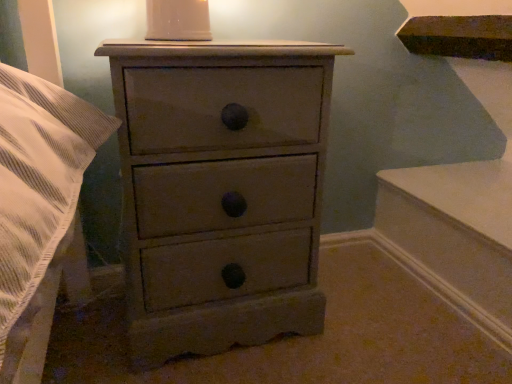
Question: Considering the positions of white glossy candle holder at upper center and matte gray chest of drawers at center in the image, is white glossy candle holder at upper center taller or shorter than matte gray chest of drawers at center?

Choices:
 (A) tall
 (B) short

Answer: (B)

Question: From a real-world perspective, is white glossy candle holder at upper center physically located above or below matte gray chest of drawers at center?

Choices:
 (A) below
 (B) above

Answer: (B)

Question: Choose the correct answer: Is white glossy candle holder at upper center inside matte gray chest of drawers at center or outside it?

Choices:
 (A) outside
 (B) inside

Answer: (A)

Question: From the image's perspective, is matte gray chest of drawers at center positioned above or below white glossy candle holder at upper center?

Choices:
 (A) above
 (B) below

Answer: (B)

Question: Would you say matte gray chest of drawers at center is inside or outside white glossy candle holder at upper center?

Choices:
 (A) outside
 (B) inside

Answer: (A)

Question: Is point tap(203, 215) positioned closer to the camera than point tap(158, 11)?

Choices:
 (A) closer
 (B) farther

Answer: (A)

Question: In the image, is matte gray chest of drawers at center positioned in front of or behind white glossy candle holder at upper center?

Choices:
 (A) behind
 (B) front

Answer: (B)